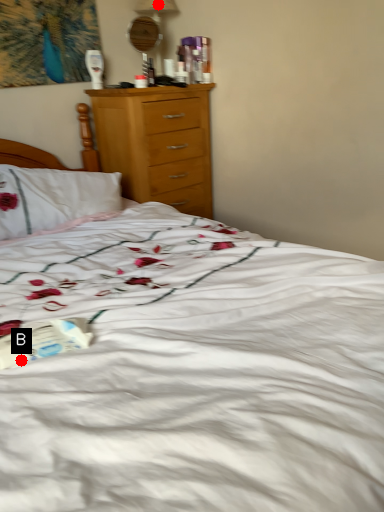
Question: Two points are circled on the image, labeled by A and B beside each circle. Which point appears farthest from the camera in this image?

Choices:
 (A) A is further
 (B) B is further

Answer: (A)